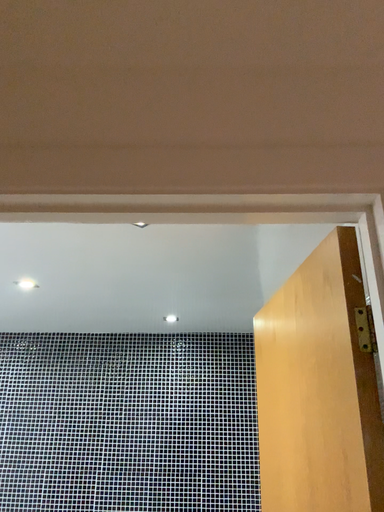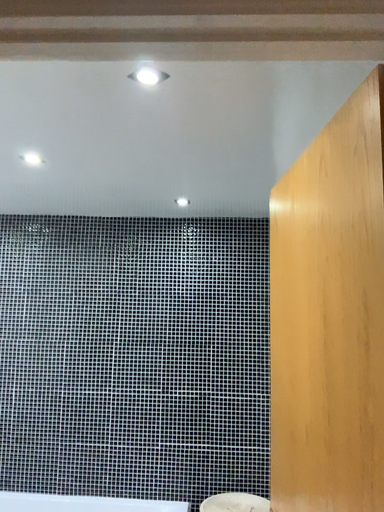
Question: Which way did the camera rotate in the video?

Choices:
 (A) rotated downward
 (B) rotated upward

Answer: (A)